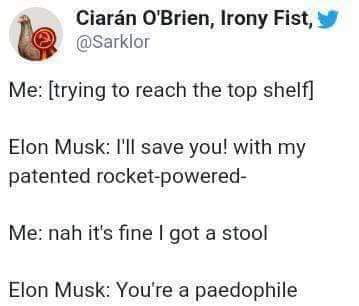
Where is `brackets`? Image resolution: width=359 pixels, height=306 pixels. brackets is located at coordinates (49, 90), (310, 90).